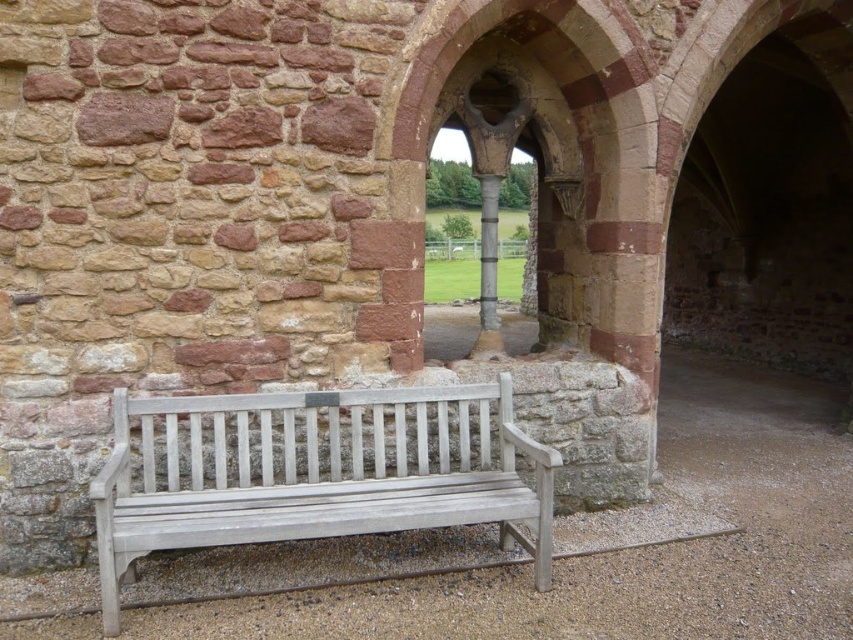
You are a painter standing in front of the white wood bench at center and the smooth gray stone pillar at center. You want to paint both objects but need to know which one is taller. Which object should you look up more to paint?

The smooth gray stone pillar at center is taller than the white wood bench at center, so you should look up more to paint the smooth gray stone pillar at center.

You are standing at the entrance of the historic structure and want to sit on the white wood bench at center. According to the coordinates provided, is the bench positioned closer to the front or the back of the structure?

The white wood bench at center is located at point (316, 474), which means it is closer to the back of the structure since the coordinates are closer to the higher end on the x and y axes.

You are a painter carrying a 1.5 meter wide canvas. You want to set up your canvas between the white wood bench at center and the smooth gray stone pillar at center. Will there be enough space for the canvas between them?

The distance between the white wood bench at center and the smooth gray stone pillar at center is 1.78 meters. Since the canvas is 1.5 meters wide, there is enough space to place it between them.